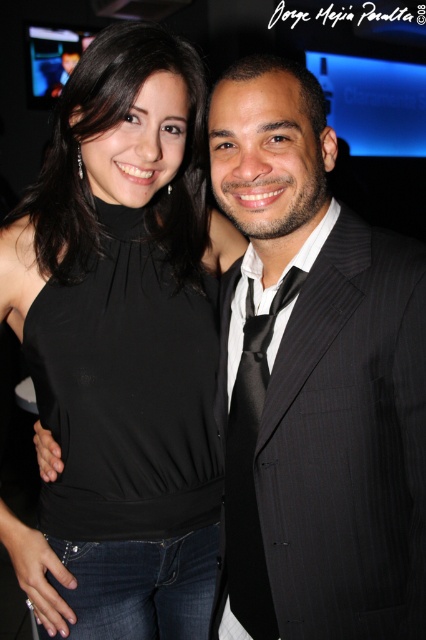
What are the coordinates of the black satin halter top at center in the image?

The black satin halter top at center is located at coordinates point (127,392).

You are a photographer trying to capture a clear shot of both the black matte top at center and the black satin halter top at center. Since both are at the center, which one is closer to the left side of the frame?

The black matte top at center is positioned on the left side of the black satin halter top at center, so it is closer to the left side of the frame.